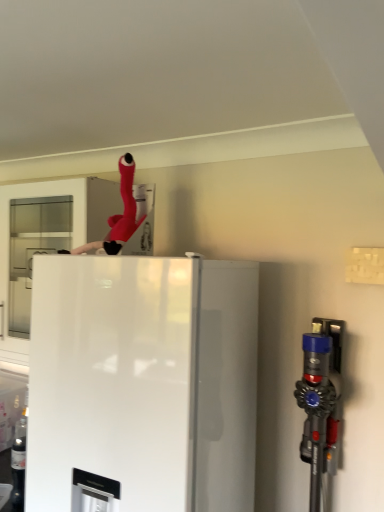
This screenshot has width=384, height=512. What do you see at coordinates (321, 402) in the screenshot?
I see `blue plastic vacuum cleaner at right` at bounding box center [321, 402].

Find the location of a particular element. rubberized red hose at upper center is located at coordinates (118, 215).

At what (x,y) coordinates should I click in order to perform the action: click on blue plastic vacuum cleaner at right. Please return your answer as a coordinate pair (x, y). The height and width of the screenshot is (512, 384). Looking at the image, I should click on (321, 402).

From the image's perspective, does white glossy refrigerator at center appear higher than blue plastic vacuum cleaner at right?

Yes, from the image's perspective, white glossy refrigerator at center is on top of blue plastic vacuum cleaner at right.

Could blue plastic vacuum cleaner at right be considered to be inside white glossy refrigerator at center?

No, blue plastic vacuum cleaner at right is not inside white glossy refrigerator at center.

Who is smaller, white glossy refrigerator at center or blue plastic vacuum cleaner at right?

With smaller size is blue plastic vacuum cleaner at right.

Is white glossy refrigerator at center oriented away from blue plastic vacuum cleaner at right?

No, white glossy refrigerator at center is not facing away from blue plastic vacuum cleaner at right.

Considering the sizes of objects rubberized red hose at upper center and white glossy refrigerator at center in the image provided, who is bigger, rubberized red hose at upper center or white glossy refrigerator at center?

Bigger between the two is white glossy refrigerator at center.

From a real-world perspective, is rubberized red hose at upper center beneath white glossy refrigerator at center?

No, from a real-world perspective, rubberized red hose at upper center is not under white glossy refrigerator at center.

Could white glossy refrigerator at center be considered to be inside rubberized red hose at upper center?

No, white glossy refrigerator at center is not inside rubberized red hose at upper center.

Is rubberized red hose at upper center positioned with its back to white glossy refrigerator at center?

rubberized red hose at upper center does not have its back to white glossy refrigerator at center.

Could you tell me if blue plastic vacuum cleaner at right is turned towards white glossy refrigerator at center?

No, blue plastic vacuum cleaner at right is not facing towards white glossy refrigerator at center.

Considering the points (324, 444) and (96, 402), which point is in front, point (324, 444) or point (96, 402)?

The point (96, 402) is closer.

Considering the sizes of blue plastic vacuum cleaner at right and white glossy refrigerator at center in the image, is blue plastic vacuum cleaner at right wider or thinner than white glossy refrigerator at center?

Clearly, blue plastic vacuum cleaner at right has less width compared to white glossy refrigerator at center.

Would you say white glossy refrigerator at center is part of blue plastic vacuum cleaner at right's contents?

No.

Considering the positions of point (334, 384) and point (117, 234), is point (334, 384) closer or farther from the camera than point (117, 234)?

Point (334, 384).

Locate an element on the screen. The width and height of the screenshot is (384, 512). appliance that is in front of the rubberized red hose at upper center is located at coordinates (321, 402).

Is blue plastic vacuum cleaner at right aimed at rubberized red hose at upper center?

No, blue plastic vacuum cleaner at right is not facing towards rubberized red hose at upper center.

Can you confirm if blue plastic vacuum cleaner at right is wider than rubberized red hose at upper center?

Yes.

Between white glossy refrigerator at center and rubberized red hose at upper center, which one appears on the left side from the viewer's perspective?

rubberized red hose at upper center is more to the left.

Looking at this image, from the image's perspective, is white glossy refrigerator at center positioned above or below rubberized red hose at upper center?

white glossy refrigerator at center is situated lower than rubberized red hose at upper center in the image.

Is point (191, 451) farther from camera compared to point (112, 244)?

That is False.

Which object is closer to the camera, white glossy refrigerator at center or rubberized red hose at upper center?

white glossy refrigerator at center is more forward.

Could you tell me if rubberized red hose at upper center is turned towards blue plastic vacuum cleaner at right?

No, rubberized red hose at upper center is not facing towards blue plastic vacuum cleaner at right.

Does point (126, 196) appear closer or farther from the camera than point (316, 425)?

Point (126, 196).

At what (x,y) coordinates should I click in order to perform the action: click on person lying above the blue plastic vacuum cleaner at right (from the image's perspective). Please return your answer as a coordinate pair (x, y). This screenshot has height=512, width=384. Looking at the image, I should click on (118, 215).

Looking at their sizes, would you say rubberized red hose at upper center is wider or thinner than blue plastic vacuum cleaner at right?

Clearly, rubberized red hose at upper center has less width compared to blue plastic vacuum cleaner at right.

Find the location of `appliance on the right of white glossy refrigerator at center`. appliance on the right of white glossy refrigerator at center is located at coordinates (321, 402).

Identify the location of refrigerator below the rubberized red hose at upper center (from a real-world perspective). (143, 383).

Which object lies nearer to the anchor point white glossy refrigerator at center, blue plastic vacuum cleaner at right or rubberized red hose at upper center?

The object closer to white glossy refrigerator at center is blue plastic vacuum cleaner at right.

Consider the image. When comparing their distances from rubberized red hose at upper center, does blue plastic vacuum cleaner at right or white glossy refrigerator at center seem closer?

Based on the image, white glossy refrigerator at center appears to be nearer to rubberized red hose at upper center.

Looking at the image, which one is located closer to blue plastic vacuum cleaner at right, white glossy refrigerator at center or rubberized red hose at upper center?

white glossy refrigerator at center is positioned closer to the anchor blue plastic vacuum cleaner at right.

Looking at the image, which one is located further to blue plastic vacuum cleaner at right, rubberized red hose at upper center or white glossy refrigerator at center?

rubberized red hose at upper center.

Looking at the image, which one is located further to rubberized red hose at upper center, white glossy refrigerator at center or blue plastic vacuum cleaner at right?

blue plastic vacuum cleaner at right is positioned further to the anchor rubberized red hose at upper center.

Which object lies nearer to the anchor point white glossy refrigerator at center, rubberized red hose at upper center or blue plastic vacuum cleaner at right?

Among the two, blue plastic vacuum cleaner at right is located nearer to white glossy refrigerator at center.

Where is `refrigerator between rubberized red hose at upper center and blue plastic vacuum cleaner at right from top to bottom`? The width and height of the screenshot is (384, 512). refrigerator between rubberized red hose at upper center and blue plastic vacuum cleaner at right from top to bottom is located at coordinates (143, 383).